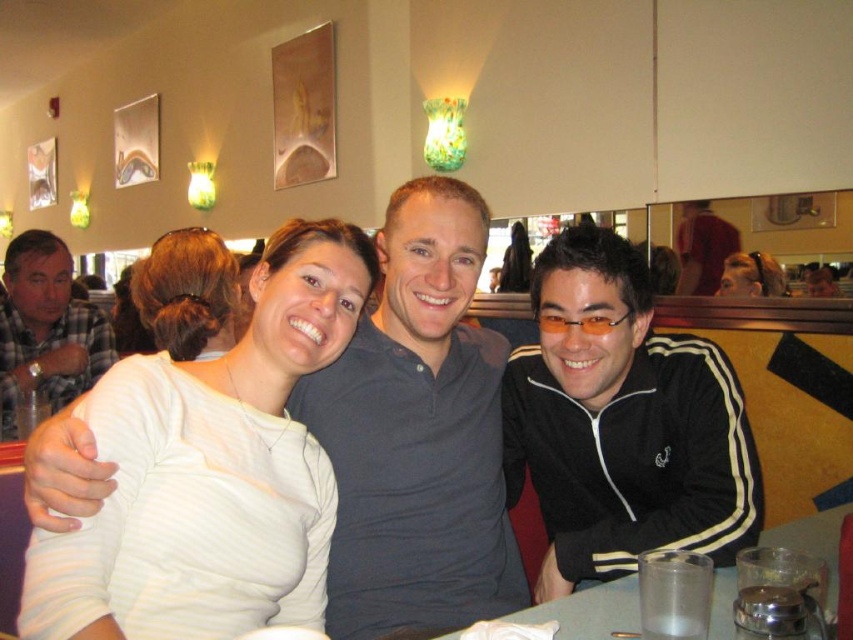
Question: Does dark blue cotton polo shirt at center lie in front of clear plastic cup at lower center?

Choices:
 (A) no
 (B) yes

Answer: (A)

Question: Does plaid shirt at left appear under blonde hair bun at center?

Choices:
 (A) no
 (B) yes

Answer: (B)

Question: Which object is farther from the camera taking this photo?

Choices:
 (A) dark brown leather jacket at upper right
 (B) blonde hair at upper right
 (C) plaid shirt at left
 (D) clear plastic cup at lower center

Answer: (A)

Question: Does white matte shirt at center appear under blonde hair at upper right?

Choices:
 (A) no
 (B) yes

Answer: (B)

Question: Which object is positioned closest to the blonde hair bun at center?

Choices:
 (A) clear plastic cup at lower center
 (B) white matte shirt at center
 (C) blonde hair at upper right

Answer: (B)

Question: Among these objects, which one is farthest from the camera?

Choices:
 (A) black zip-up jacket at center
 (B) plaid shirt at left

Answer: (B)